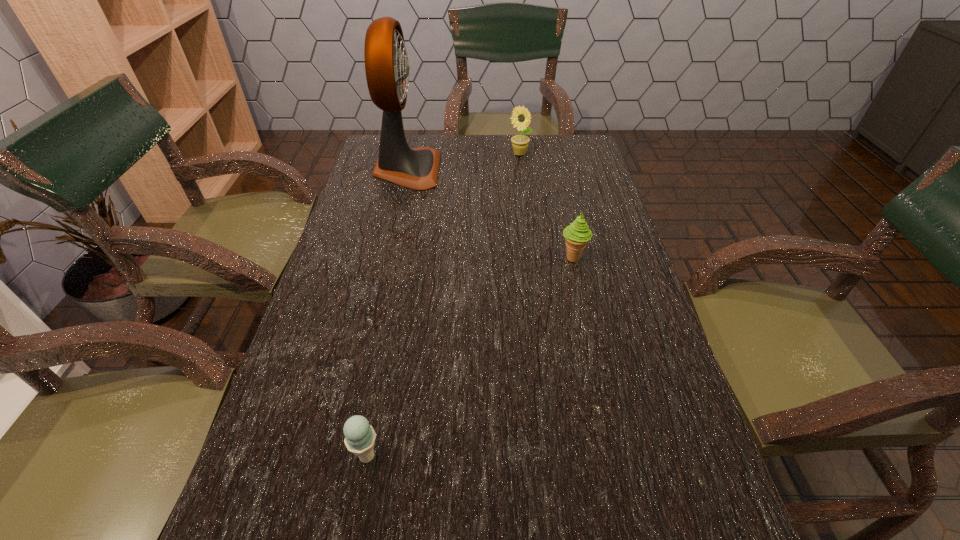
The image size is (960, 540). I want to click on vacant region at the far right corner of the desktop, so click(x=578, y=143).

Image resolution: width=960 pixels, height=540 pixels. Find the location of `empty location between the farther ice cream and the nearest object`. empty location between the farther ice cream and the nearest object is located at coordinates (470, 356).

You are a GUI agent. You are given a task and a screenshot of the screen. Output one action in this format:
    pyautogui.click(x=<x>, y=<y>)
    Task: Click on the empty location between the third object from left to right and the nearest object
    
    Given the screenshot: What is the action you would take?
    pyautogui.click(x=444, y=305)

I want to click on vacant area that lies between the tallest object and the nearer ice cream, so click(387, 313).

Locate an element on the screen. The width and height of the screenshot is (960, 540). free point between the rightmost object and the fan is located at coordinates (490, 214).

Where is `free point between the taller ice cream and the nearest object`? free point between the taller ice cream and the nearest object is located at coordinates (470, 356).

Identify which object is the second closest to the nearest object. Please provide its 2D coordinates. Your answer should be formatted as a tuple, i.e. [(x, y)], where the tuple contains the x and y coordinates of a point satisfying the conditions above.

[(387, 67)]

The image size is (960, 540). Identify the location of object that is the closest to the fan. (519, 142).

Where is `free space that satisfies the following two spatial constraints: 1. on the front-facing side of the fan; 2. on the left side of the taller ice cream`? This screenshot has height=540, width=960. free space that satisfies the following two spatial constraints: 1. on the front-facing side of the fan; 2. on the left side of the taller ice cream is located at coordinates [x=387, y=258].

You are a GUI agent. You are given a task and a screenshot of the screen. Output one action in this format:
    pyautogui.click(x=<x>, y=<y>)
    Task: Click on the vacant area that satisfies the following two spatial constraints: 1. on the front-facing side of the tallest object; 2. on the right side of the nearer ice cream
    Image resolution: width=960 pixels, height=540 pixels.
    Given the screenshot: What is the action you would take?
    pyautogui.click(x=342, y=456)